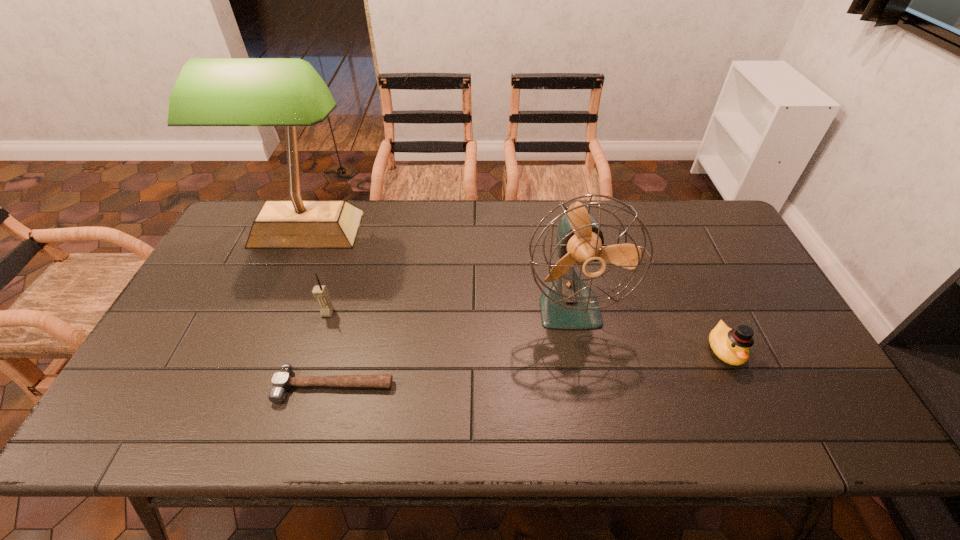
Identify the location of the farthest object. This screenshot has width=960, height=540. (288, 92).

You are a GUI agent. You are given a task and a screenshot of the screen. Output one action in this format:
    pyautogui.click(x=<x>, y=<y>)
    Task: Click on the tallest object
    This screenshot has height=540, width=960.
    Given the screenshot: What is the action you would take?
    pyautogui.click(x=288, y=92)

This screenshot has height=540, width=960. I want to click on the second tallest object, so click(566, 303).

What are the coordinates of `fan` in the screenshot? It's located at (566, 303).

Where is `the third shortest object`? This screenshot has width=960, height=540. the third shortest object is located at coordinates (320, 292).

The image size is (960, 540). I want to click on the rightmost object, so click(732, 346).

You are a GUI agent. You are given a task and a screenshot of the screen. Output one action in this format:
    pyautogui.click(x=<x>, y=<y>)
    Task: Click on the duck
    Image resolution: width=960 pixels, height=540 pixels.
    Given the screenshot: What is the action you would take?
    pyautogui.click(x=732, y=346)

Locate an element on the screen. This screenshot has width=960, height=540. hammer is located at coordinates pos(282,380).

Identify the location of vacant position located 0.290m on the metallic stand of the tallest object. (261, 337).

What are the coordinates of `free location located on the front-facing side of the fan for air flow` in the screenshot? It's located at point(589,412).